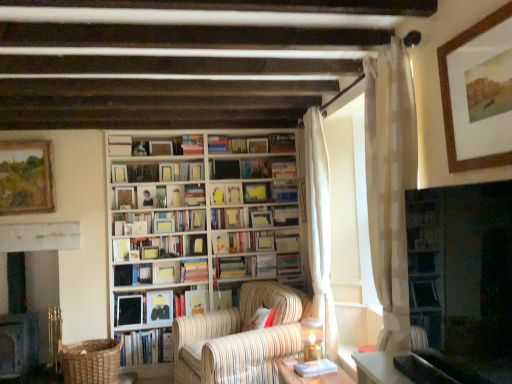
Locate an element on the screen. free space in front of hardcover book at lower center, arranged as the second book when ordered from the bottom is located at coordinates (322, 378).